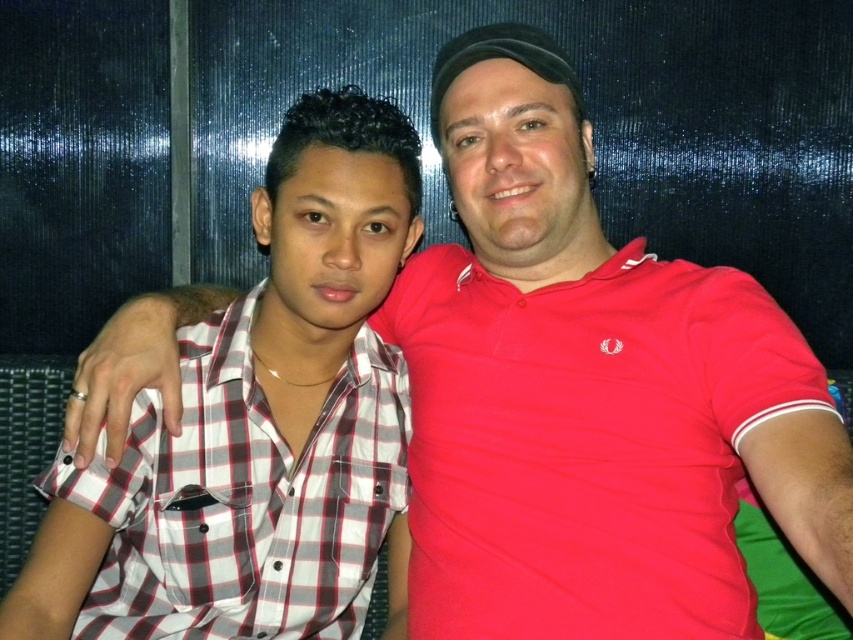
You are trying to decide which person to ask for help in a store. You notice the red cotton polo shirt at right and the white checkered shirt at left. Based on their clothing sizes, which person might be more approachable?

The red cotton polo shirt at right is wider than the white checkered shirt at left, so the person wearing the red cotton polo shirt at right might be more approachable as they appear more open and friendly due to the larger size of their clothing.